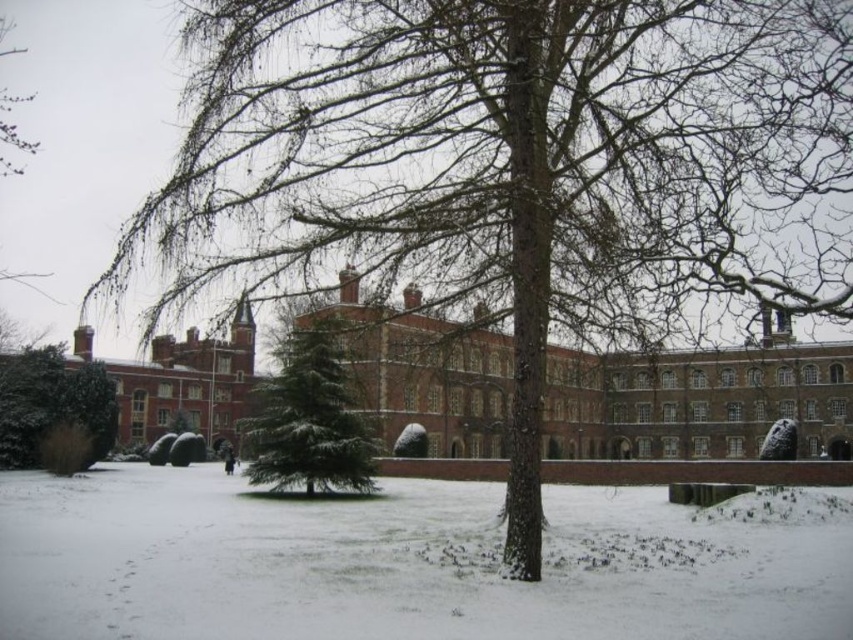
Question: Which object is the farthest from the green matte tree at left?

Choices:
 (A) green matte tree at center
 (B) white powdery snow at center

Answer: (B)

Question: Which point is closer to the camera taking this photo?

Choices:
 (A) (16, 397)
 (B) (265, 481)

Answer: (B)

Question: Is white powdery snow at center wider than green matte tree at center?

Choices:
 (A) no
 (B) yes

Answer: (B)

Question: Is green matte tree at center thinner than green matte tree at left?

Choices:
 (A) yes
 (B) no

Answer: (B)

Question: Which of these objects is positioned closest to the green matte tree at center?

Choices:
 (A) green matte tree at left
 (B) white powdery snow at center

Answer: (B)

Question: Does white powdery snow at center appear over green matte tree at left?

Choices:
 (A) no
 (B) yes

Answer: (A)